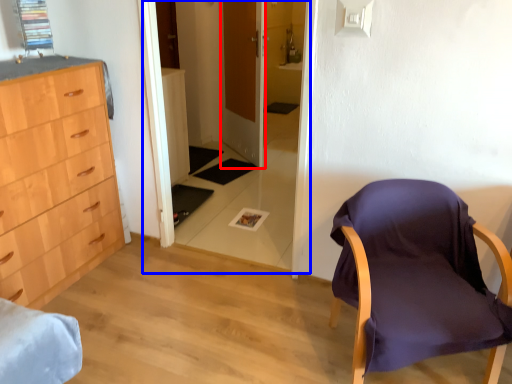
Question: Which point is closer to the camera, door (highlighted by a red box) or glass door (highlighted by a blue box)?

Choices:
 (A) door
 (B) glass door

Answer: (B)